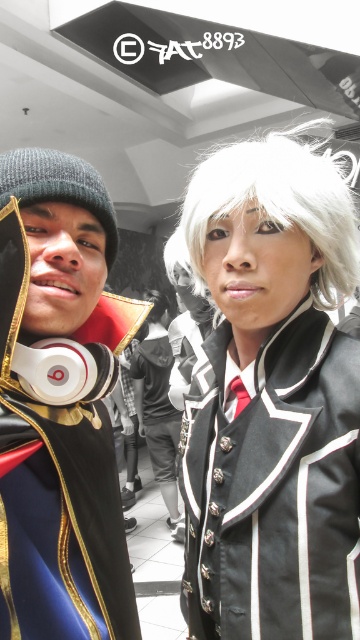
You are taking a photo of two people. You notice the matte black hoodie at left and the satin black wig at upper right. Which object is nearer to the camera?

The matte black hoodie at left is closer to the viewer than the satin black wig at upper right, so the matte black hoodie at left is nearer to the camera.

You are a photographer at the event and need to adjust the lighting to ensure both the matte black hoodie at left and the white silky wig at upper right are well lit. Considering their sizes, which object might require more focused lighting to capture details?

The white silky wig at upper right requires more focused lighting because it is larger than the matte black hoodie at left, making it easier to lose details in the lighting setup.